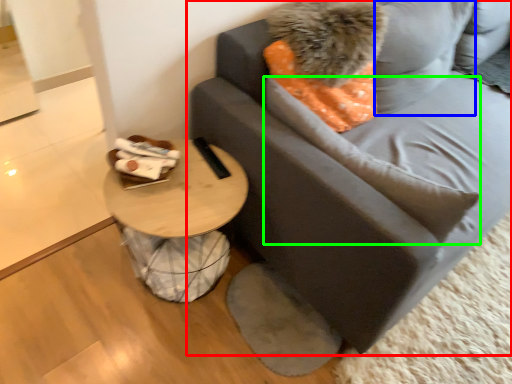
Question: Based on their relative distances, which object is nearer to studio couch (highlighted by a red box)? Choose from pillow (highlighted by a blue box) and pillow (highlighted by a green box).

Choices:
 (A) pillow
 (B) pillow

Answer: (A)